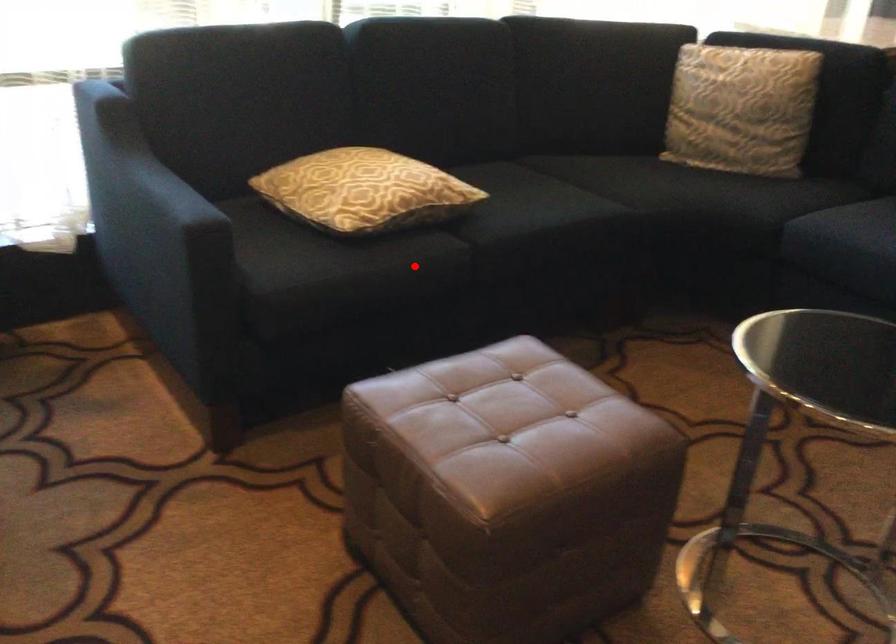
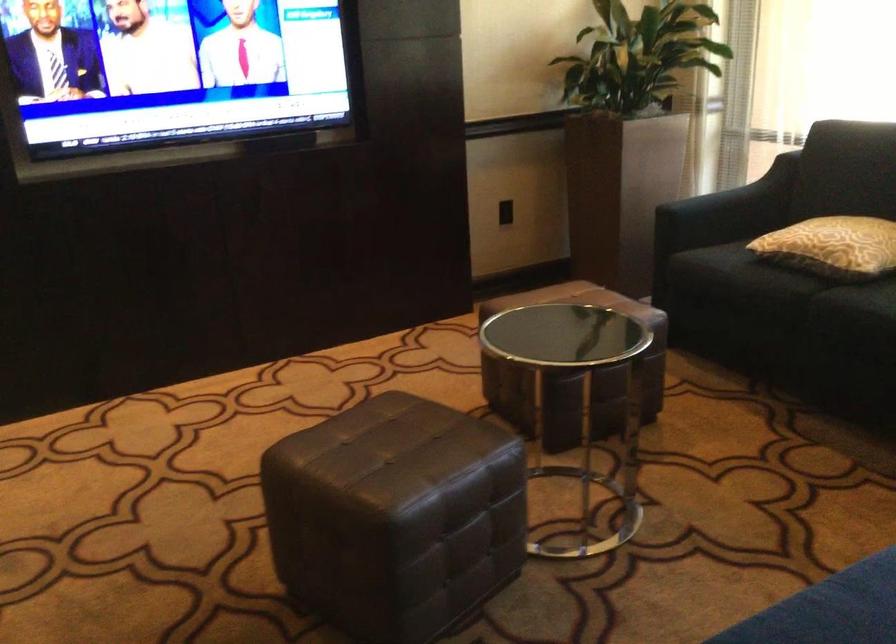
Locate, in the second image, the point that corresponds to the highlighted location in the first image.

(767, 283)